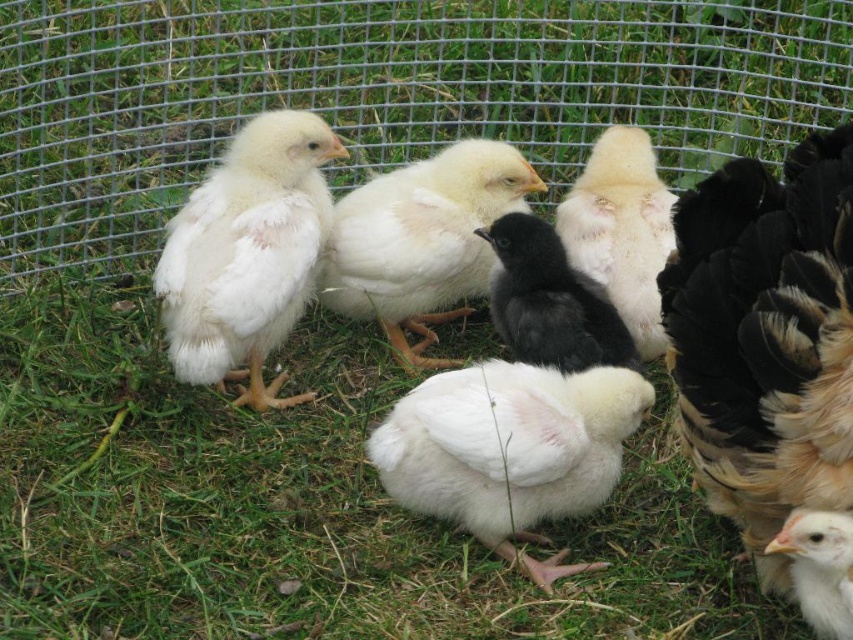
You are a farmer looking after the chicks in the image. You notice the black feathered chicken at right and the fluffy white chick at center. Which one is positioned to the right side of the other?

The black feathered chicken at right is to the right of the fluffy white chick at center.

You are a small robot trying to reach the white fluffy chick at center. The green wire mesh at upper center is in your way. Can you go under it?

The green wire mesh at upper center is much taller than the white fluffy chick at center, so yes, you can go under the green wire mesh at upper center to reach the white fluffy chick at center.

You are a farmer checking on the chicks in the fenced area. You need to locate the white fluffy chick at left. Where exactly is it positioned in the image?

The white fluffy chick at left is positioned at point (247,253) in the image.